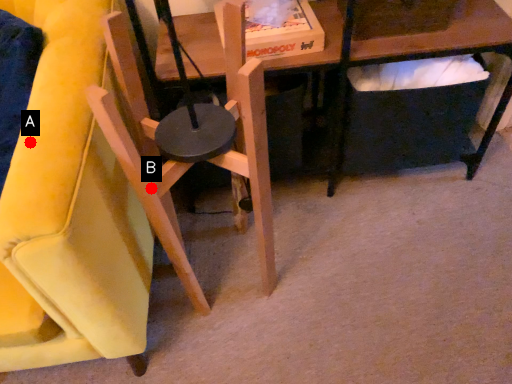
Question: Two points are circled on the image, labeled by A and B beside each circle. Which point is further to the camera?

Choices:
 (A) A is further
 (B) B is further

Answer: (B)